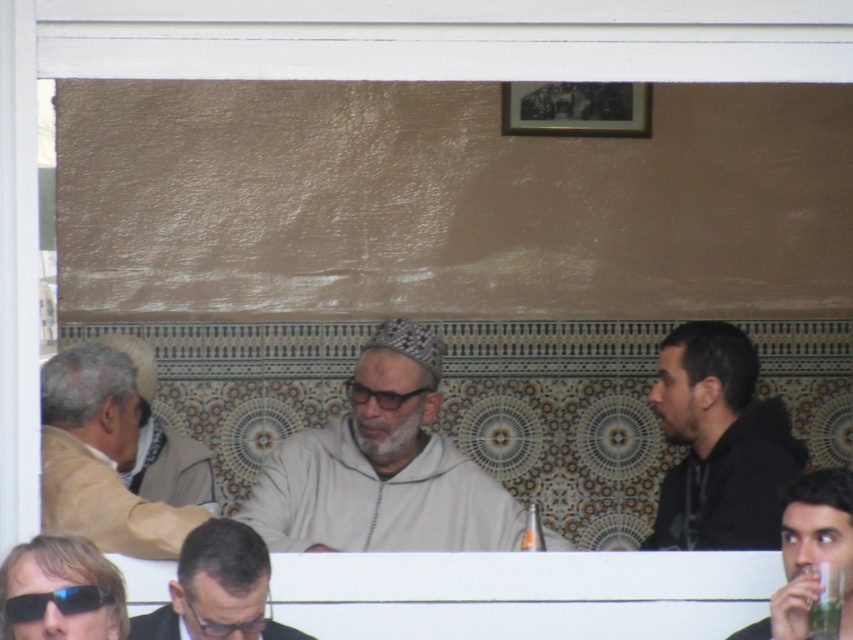
You are a photographer trying to capture a clear shot of both the light beige jacket at left and the shiny blue plastic goggles at lower left. Since you want both items to appear equally large in the photo, which object should you move closer to the camera?

The light beige jacket at left is taller than the shiny blue plastic goggles at lower left. To make them appear equally large in the photo, you should move the shiny blue plastic goggles at lower left closer to the camera since it is smaller in size and needs to be magnified more to match the size of the taller jacket.